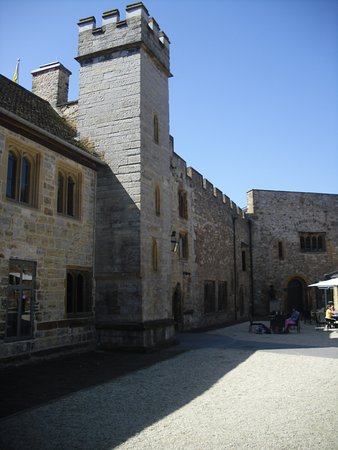
The image size is (338, 450). What are the coordinates of `empty chair across from person wearing pink pants` in the screenshot? It's located at (259, 322).